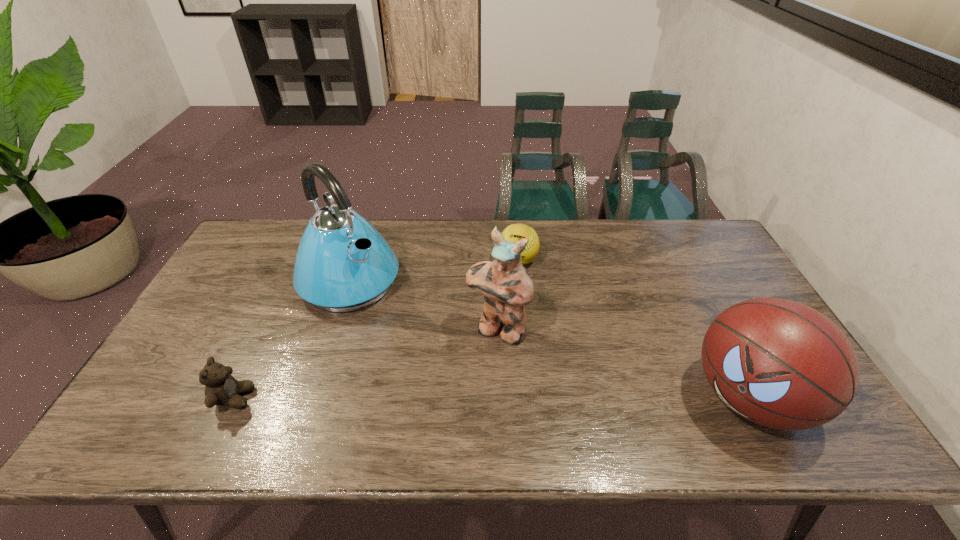
Find the location of a particular element. The image size is (960, 540). vacant region located on the logo side of the softball is located at coordinates (494, 328).

This screenshot has height=540, width=960. Identify the location of vacant area located on the front-facing side of the fourth shortest object. (450, 406).

Where is `vacant space located on the front-facing side of the fourth shortest object`? The width and height of the screenshot is (960, 540). vacant space located on the front-facing side of the fourth shortest object is located at coordinates (458, 393).

Image resolution: width=960 pixels, height=540 pixels. I want to click on free space located 0.060m on the front-facing side of the fourth shortest object, so click(475, 363).

Locate an element on the screen. The width and height of the screenshot is (960, 540). vacant space located 0.340m at the spout of the kettle is located at coordinates (458, 376).

Identify the location of vacant region located 0.260m at the spout of the kettle. (438, 357).

In order to click on free region located at the spout of the kettle in this screenshot , I will do click(x=409, y=333).

Image resolution: width=960 pixels, height=540 pixels. Find the location of `softball at the far edge`. softball at the far edge is located at coordinates (515, 232).

This screenshot has height=540, width=960. What are the coordinates of `kettle that is at the far edge` in the screenshot? It's located at (342, 264).

Locate an element on the screen. This screenshot has height=540, width=960. teddy bear situated at the near edge is located at coordinates (221, 389).